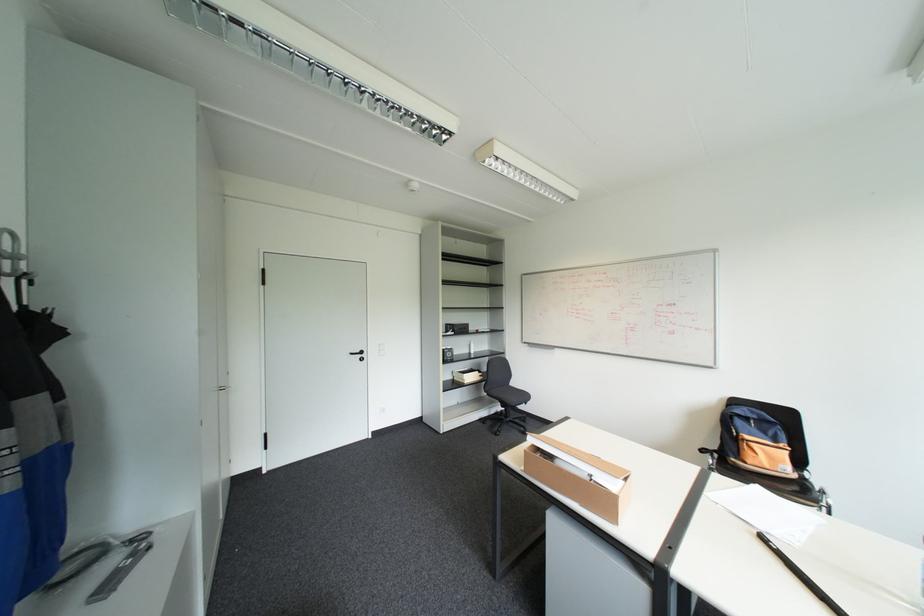
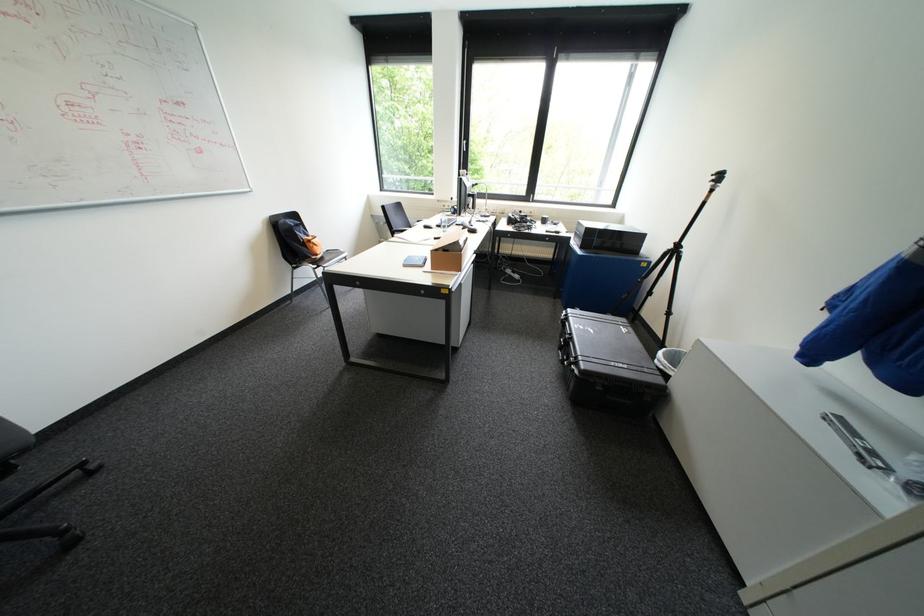
Question: I am providing you with two images of the same scene from different viewpoints. Which of the following objects are not visible in image2?

Choices:
 (A) white folded towel
 (B) white trash can
 (C) orange backpack
 (D) cardboard box

Answer: (D)